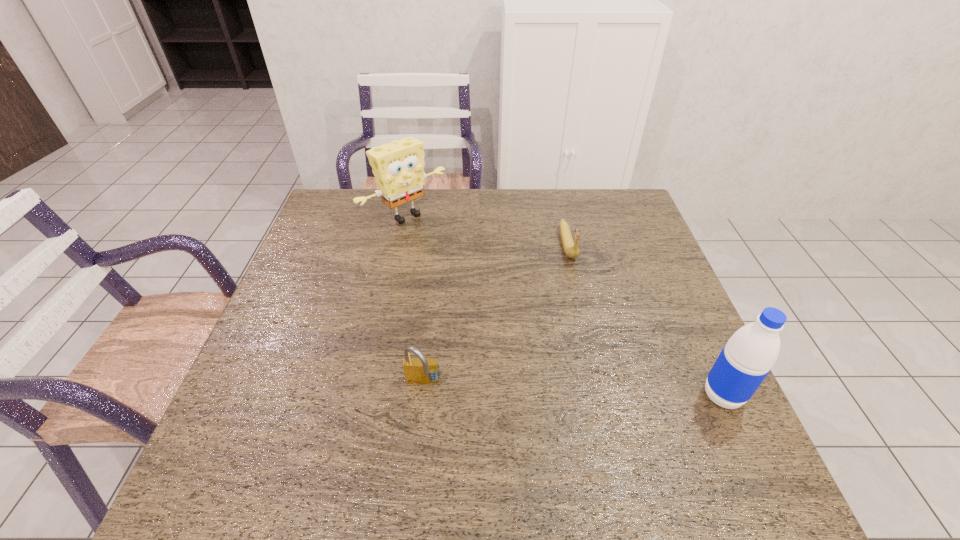
Image resolution: width=960 pixels, height=540 pixels. I want to click on free spot on the desktop that is between the padlock and the water bottle and is positioned at the stem of the third object from left to right, so click(611, 391).

Locate an element on the screen. The height and width of the screenshot is (540, 960). free space on the desktop that is between the padlock and the water bottle and is positioned on the face of the sponge is located at coordinates (607, 391).